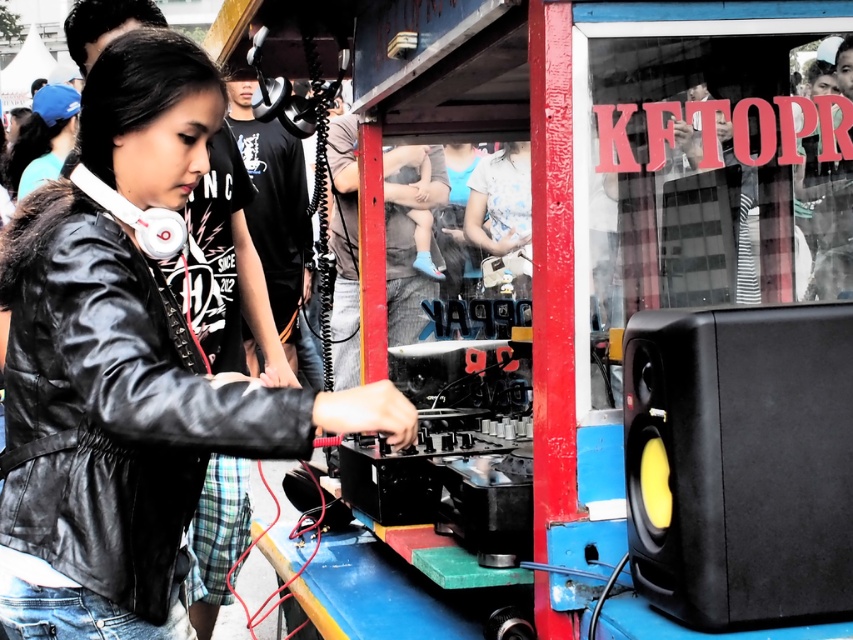
This screenshot has height=640, width=853. What do you see at coordinates (126, 369) in the screenshot?
I see `black leather jacket at center` at bounding box center [126, 369].

At what (x,y) coordinates should I click in order to perform the action: click on black leather jacket at center. Please return your answer as a coordinate pair (x, y). This screenshot has width=853, height=640. Looking at the image, I should click on (126, 369).